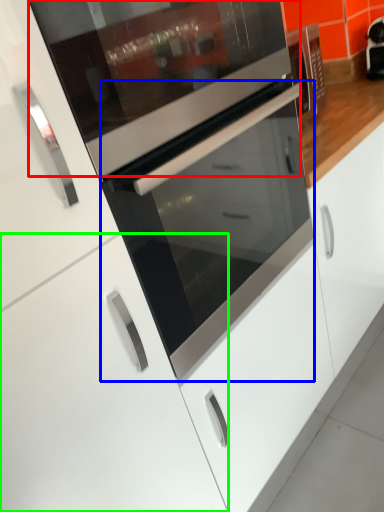
Question: Which is farther away from appliance (highlighted by a red box)? oven (highlighted by a blue box) or cabinetry (highlighted by a green box)?

Choices:
 (A) oven
 (B) cabinetry

Answer: (B)